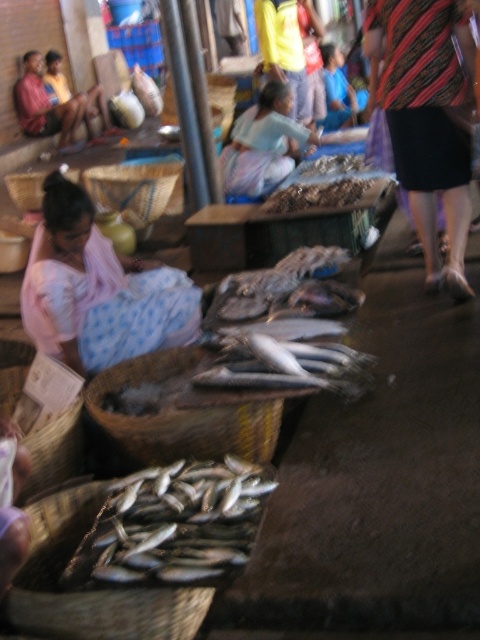
Question: Is silvery metallic fish at lower left closer to camera compared to brown woven basket at center?

Choices:
 (A) no
 (B) yes

Answer: (B)

Question: Which point is closer to the camera taking this photo?

Choices:
 (A) (37, 205)
 (B) (205, 589)
 (C) (177, 330)

Answer: (B)

Question: Which object is closer to the camera taking this photo?

Choices:
 (A) woven bamboo basket at center
 (B) brown woven basket at lower left
 (C) woven bamboo basket at lower left
 (D) brown woven basket at left

Answer: (B)

Question: Is pink fabric at lower left to the right of brown woven basket at center from the viewer's perspective?

Choices:
 (A) yes
 (B) no

Answer: (B)

Question: Can you confirm if pink fabric at lower left is wider than woven bamboo basket at center?

Choices:
 (A) no
 (B) yes

Answer: (A)

Question: Which of the following is the farthest from the observer?

Choices:
 (A) (60, 241)
 (B) (188, 349)

Answer: (B)